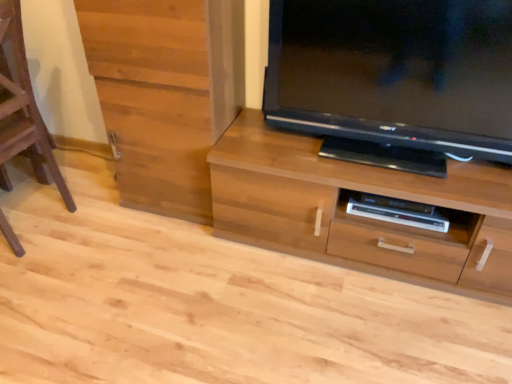
What is the approximate height of satin wood shelf at lower center?

satin wood shelf at lower center is 1.76 inches in height.

Describe the element at coordinates (408, 219) in the screenshot. I see `satin wood shelf at lower center` at that location.

Locate an element on the screen. This screenshot has height=384, width=512. wooden cabinet at left is located at coordinates (165, 93).

From the picture: Measure the distance between point (x=61, y=195) and camera.

They are 2.06 meters apart.

This screenshot has height=384, width=512. What are the coordinates of `wooden chest of drawers at center` in the screenshot? It's located at (359, 217).

From the image's perspective, relative to wooden chest of drawers at center, is wooden cabinet at left above or below?

From the image's perspective, wooden cabinet at left appears above wooden chest of drawers at center.

From a real-world perspective, who is located lower, wooden cabinet at left or wooden chest of drawers at center?

In real-world perspective, wooden chest of drawers at center is lower.

Consider the image. Which is more to the right, wooden cabinet at left or wooden chest of drawers at center?

wooden chest of drawers at center is more to the right.

Who is more distant, wooden cabinet at left or satin wood shelf at lower center?

satin wood shelf at lower center is further away from the camera.

Considering the sizes of wooden cabinet at left and satin wood shelf at lower center in the image, is wooden cabinet at left wider or thinner than satin wood shelf at lower center?

Clearly, wooden cabinet at left has more width compared to satin wood shelf at lower center.

Is satin wood shelf at lower center at the back of wooden cabinet at left?

No.

Are wooden cabinet at left and satin wood shelf at lower center making contact?

wooden cabinet at left and satin wood shelf at lower center are not in contact.

Where is `television below the wooden cabinet at left (from the image's perspective)`? Image resolution: width=512 pixels, height=384 pixels. television below the wooden cabinet at left (from the image's perspective) is located at coordinates (394, 73).

Is point (317, 103) closer or farther from the camera than point (168, 6)?

Clearly, point (317, 103) is more distant from the camera than point (168, 6).

Is black glossy television at upper right with wooden cabinet at left?

No, black glossy television at upper right is not making contact with wooden cabinet at left.

Is black glossy television at upper right closer to the viewer compared to wooden cabinet at left?

Yes, it is in front of wooden cabinet at left.

Does wooden chest of drawers at center have a greater width compared to satin wood shelf at lower center?

Correct, the width of wooden chest of drawers at center exceeds that of satin wood shelf at lower center.

Is wooden chest of drawers at center taller than satin wood shelf at lower center?

Yes.

Is wooden chest of drawers at center to the left of satin wood shelf at lower center from the viewer's perspective?

Yes, wooden chest of drawers at center is to the left of satin wood shelf at lower center.

What's the angular difference between wooden chest of drawers at center and satin wood shelf at lower center's facing directions?

The angle between the facing direction of wooden chest of drawers at center and the facing direction of satin wood shelf at lower center is 3.06 degrees.

Between brown wooden stool at left and wooden chest of drawers at center, which one has smaller size?

brown wooden stool at left is smaller.

Is brown wooden stool at left facing towards wooden chest of drawers at center?

No, brown wooden stool at left is not aimed at wooden chest of drawers at center.

From the image's perspective, is brown wooden stool at left on top of wooden chest of drawers at center?

Yes, from the image's perspective, brown wooden stool at left is on top of wooden chest of drawers at center.

Is black glossy television at upper right bigger than satin wood shelf at lower center?

Indeed, black glossy television at upper right has a larger size compared to satin wood shelf at lower center.

From the image's perspective, is black glossy television at upper right above or below satin wood shelf at lower center?

Based on their image positions, black glossy television at upper right is located above satin wood shelf at lower center.

Is satin wood shelf at lower center at the back of black glossy television at upper right?

black glossy television at upper right is not turned away from satin wood shelf at lower center.

Can you tell me how much satin wood shelf at lower center and brown wooden stool at left differ in facing direction?

The facing directions of satin wood shelf at lower center and brown wooden stool at left are 95.3 degrees apart.

Is satin wood shelf at lower center taller than brown wooden stool at left?

No.

Between satin wood shelf at lower center and brown wooden stool at left, which one has smaller size?

With smaller size is satin wood shelf at lower center.

Considering the relative positions of satin wood shelf at lower center and brown wooden stool at left in the image provided, is satin wood shelf at lower center behind brown wooden stool at left?

Yes, satin wood shelf at lower center is further from the camera.

In the image, there is a wooden cabinet at left. Identify the location of the chest of drawers below it (from the image's perspective). (359, 217).

Where is `cabinetry on the left of the satin wood shelf at lower center`? The image size is (512, 384). cabinetry on the left of the satin wood shelf at lower center is located at coordinates (165, 93).

When comparing their distances from black glossy television at upper right, does brown wooden stool at left or wooden cabinet at left seem further?

The object further to black glossy television at upper right is brown wooden stool at left.

Considering their positions, is black glossy television at upper right positioned further to wooden chest of drawers at center than brown wooden stool at left?

Based on the image, brown wooden stool at left appears to be further to wooden chest of drawers at center.

Which object lies further to the anchor point brown wooden stool at left, wooden cabinet at left or wooden chest of drawers at center?

wooden chest of drawers at center lies further to brown wooden stool at left than the other object.

Which object lies nearer to the anchor point satin wood shelf at lower center, black glossy television at upper right or wooden chest of drawers at center?

The object closer to satin wood shelf at lower center is wooden chest of drawers at center.

Consider the image. From the image, which object appears to be farther from brown wooden stool at left, black glossy television at upper right or wooden chest of drawers at center?

Based on the image, black glossy television at upper right appears to be further to brown wooden stool at left.

From the image, which object appears to be farther from brown wooden stool at left, black glossy television at upper right or satin wood shelf at lower center?

Among the two, satin wood shelf at lower center is located further to brown wooden stool at left.

From the image, which object appears to be farther from brown wooden stool at left, satin wood shelf at lower center or black glossy television at upper right?

The object further to brown wooden stool at left is satin wood shelf at lower center.

In the scene shown: Estimate the real-world distances between objects in this image. Which object is further from satin wood shelf at lower center, wooden chest of drawers at center or black glossy television at upper right?

black glossy television at upper right.

This screenshot has width=512, height=384. Find the location of `television situated between wooden cabinet at left and satin wood shelf at lower center from left to right`. television situated between wooden cabinet at left and satin wood shelf at lower center from left to right is located at coordinates (394, 73).

The width and height of the screenshot is (512, 384). Identify the location of television between brown wooden stool at left and satin wood shelf at lower center from left to right. (394, 73).

Image resolution: width=512 pixels, height=384 pixels. Identify the location of television situated between brown wooden stool at left and wooden chest of drawers at center from left to right. (394, 73).

The height and width of the screenshot is (384, 512). Identify the location of chest of drawers between brown wooden stool at left and satin wood shelf at lower center. (359, 217).